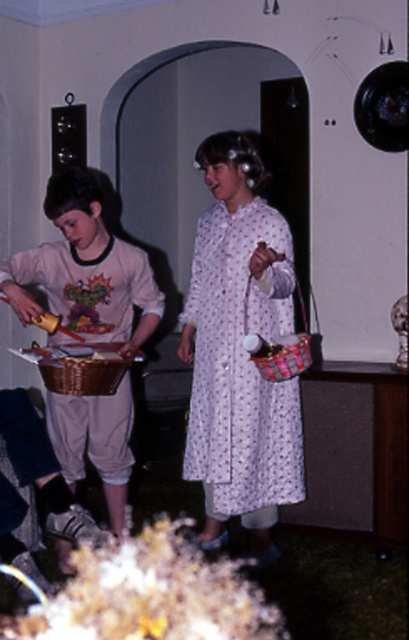
Question: Among these points, which one is nearest to the camera?

Choices:
 (A) (274, 483)
 (B) (29, 312)

Answer: (B)

Question: Is white floral dress at center wider than light pink cotton dress at center?

Choices:
 (A) no
 (B) yes

Answer: (A)

Question: Does white floral dress at center come in front of light pink cotton dress at center?

Choices:
 (A) no
 (B) yes

Answer: (B)

Question: Is white floral dress at center thinner than light pink cotton dress at center?

Choices:
 (A) yes
 (B) no

Answer: (A)